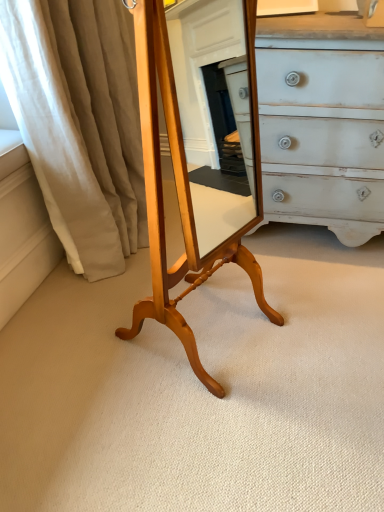
Question: From the image's perspective, is light brown wood table at center located above or below beige fabric curtain at left?

Choices:
 (A) below
 (B) above

Answer: (A)

Question: Does point (180, 180) appear closer or farther from the camera than point (69, 110)?

Choices:
 (A) farther
 (B) closer

Answer: (B)

Question: Looking at the image, does light brown wood table at center seem bigger or smaller compared to beige fabric curtain at left?

Choices:
 (A) big
 (B) small

Answer: (B)

Question: Would you say beige fabric curtain at left is to the left or to the right of light brown wood table at center in the picture?

Choices:
 (A) left
 (B) right

Answer: (A)

Question: Is beige fabric curtain at left inside the boundaries of light brown wood table at center, or outside?

Choices:
 (A) outside
 (B) inside

Answer: (A)

Question: Looking at the image, does beige fabric curtain at left seem bigger or smaller compared to light brown wood table at center?

Choices:
 (A) big
 (B) small

Answer: (A)

Question: Is point (23, 90) positioned closer to the camera than point (160, 280)?

Choices:
 (A) closer
 (B) farther

Answer: (B)